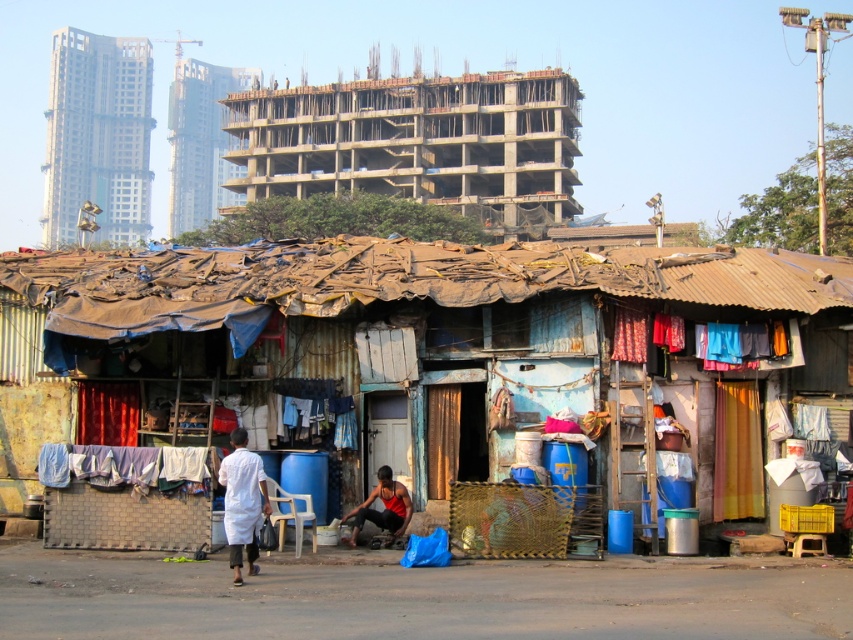
You are a photographer standing in the middle of the scene. You want to take a photo that includes both the point at coordinates point [474,340] and point [84,467]. Which point should you focus on first to ensure both are in focus?

You should focus on point [474,340] first because it is closer to the camera than point [84,467], ensuring both points are within the depth of field.

You are a photographer standing in the foreground of the image, aiming to capture the contrast between the urban development and the slum. To frame the shot, you want to ensure the concrete building at upper center and the white cloth at center are both visible. Which object should you position closer to the left side of the frame?

The concrete building at upper center should be positioned closer to the left side of the frame because it is already located to the left of the white cloth at center.